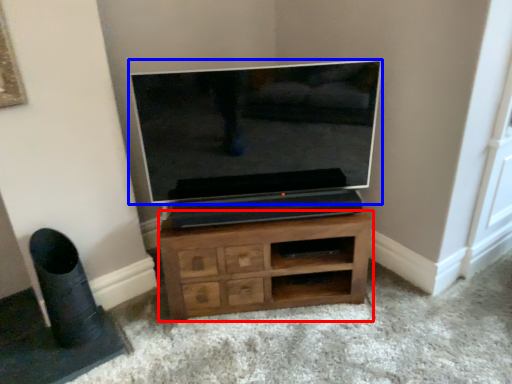
Question: Which point is further to the camera, chest of drawers (highlighted by a red box) or television (highlighted by a blue box)?

Choices:
 (A) chest of drawers
 (B) television

Answer: (A)